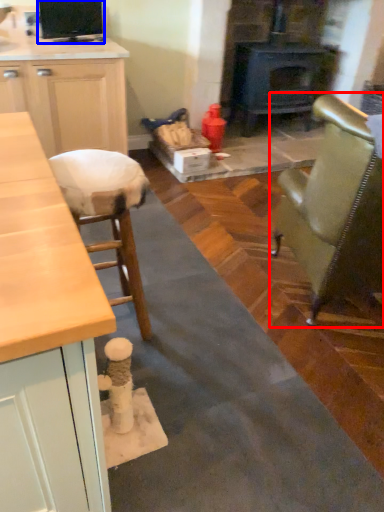
Question: Which object is closer to the camera taking this photo, chair (highlighted by a red box) or appliance (highlighted by a blue box)?

Choices:
 (A) chair
 (B) appliance

Answer: (A)